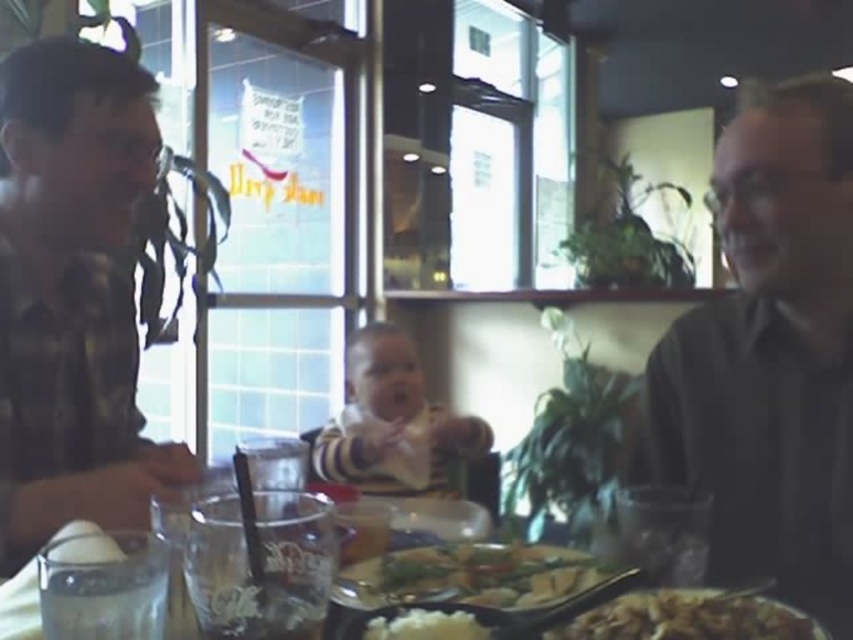
From the picture: You are a waiter in a restaurant. You need to place a 6 inch long spoon between the shiny silver plate at center and the clear plastic cups at lower center. Is there enough space?

The shiny silver plate at center and clear plastic cups at lower center are 5.72 inches apart from each other. Since the spoon is 6 inches long, there isn not enough space to place it between them.

You are a photographer standing 3 feet away from the camera. You want to take a picture of the plaid flannel shirt at left without moving the shirt. Can you adjust your position to be closer to the camera to achieve this?

The plaid flannel shirt at left and camera are 33.68 inches apart from each other. Since you are already 3 feet away from the camera, which is 36 inches, you can move closer to the camera by approximately 2.32 inches to be within the distance between you and the shirt, allowing you to take the photo without moving the shirt.

You are at the point labeled as point (169, 531) and want to walk to the point labeled as point (518, 566). Based on the scene, which direction should you move in?

You should move backward because point (518, 566) is behind point (169, 531).